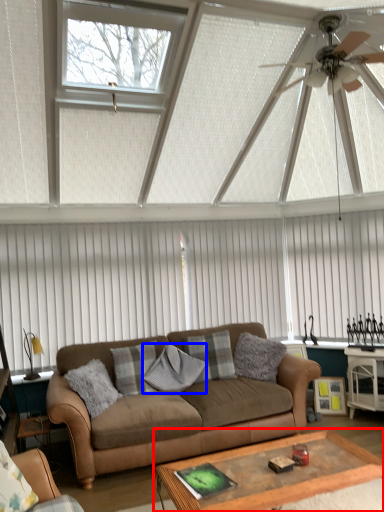
Question: Which object appears farthest to the camera in this image, coffee table (highlighted by a red box) or pillow (highlighted by a blue box)?

Choices:
 (A) coffee table
 (B) pillow

Answer: (B)